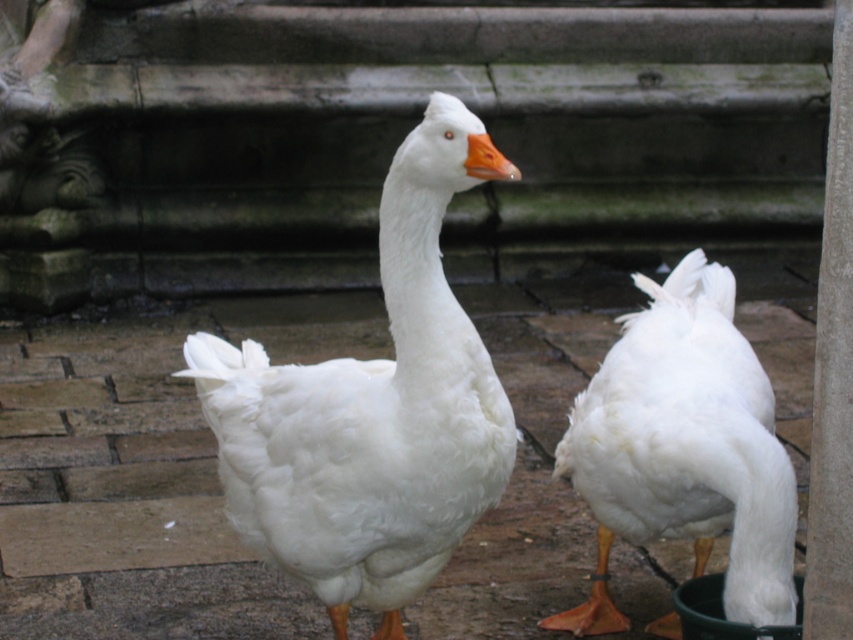
Question: Is white fluffy goose at center below white fluffy duck at lower right?

Choices:
 (A) no
 (B) yes

Answer: (A)

Question: Which point is closer to the camera?

Choices:
 (A) white fluffy goose at center
 (B) white fluffy duck at lower right

Answer: (A)

Question: Is white fluffy goose at center in front of white fluffy duck at lower right?

Choices:
 (A) yes
 (B) no

Answer: (A)

Question: Which point is closer to the camera?

Choices:
 (A) (757, 376)
 (B) (260, 556)

Answer: (B)

Question: Does white fluffy goose at center lie in front of white fluffy duck at lower right?

Choices:
 (A) no
 (B) yes

Answer: (B)

Question: Which point is farther to the camera?

Choices:
 (A) white fluffy duck at lower right
 (B) white fluffy goose at center

Answer: (A)